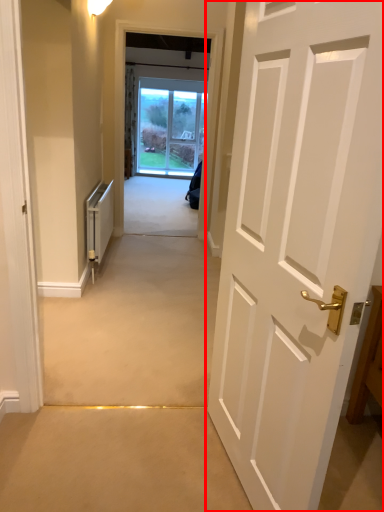
Question: From the image's perspective, where is door (annotated by the red box) located in relation to appliance in the image?

Choices:
 (A) below
 (B) above

Answer: (A)